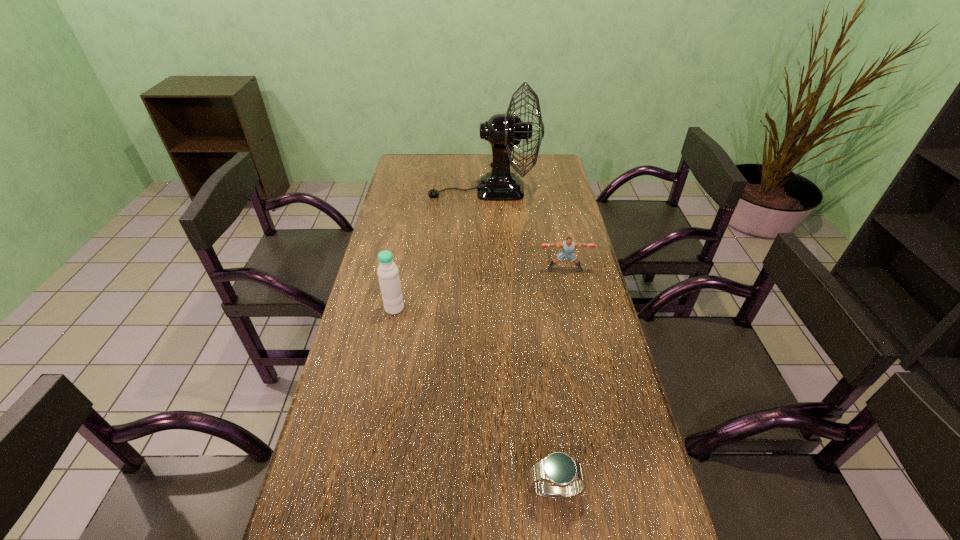
Where is `free space between the second nearest object and the farthest object`? free space between the second nearest object and the farthest object is located at coordinates (439, 249).

Where is `vacant space in between the second tallest object and the third nearest object`? Image resolution: width=960 pixels, height=540 pixels. vacant space in between the second tallest object and the third nearest object is located at coordinates tap(479, 289).

Where is `vacant space in between the third shortest object and the farthest object`? This screenshot has width=960, height=540. vacant space in between the third shortest object and the farthest object is located at coordinates (439, 249).

Identify the location of vacant region between the puncher and the second tallest object. (479, 289).

The image size is (960, 540). I want to click on vacant region between the third nearest object and the tallest object, so click(x=524, y=230).

Identify the location of blank region between the third tallest object and the farthest object. (524, 230).

You are a GUI agent. You are given a task and a screenshot of the screen. Output one action in this format:
    pyautogui.click(x=<x>, y=<y>)
    Task: Click on the blank region between the nearest object and the farthest object
    
    Given the screenshot: What is the action you would take?
    pyautogui.click(x=519, y=341)

Where is `object that is the closest to the leftmost object`? The height and width of the screenshot is (540, 960). object that is the closest to the leftmost object is located at coordinates (568, 245).

Select which object is the closest to the farthest object. Please provide its 2D coordinates. Your answer should be formatted as a tuple, i.e. [(x, y)], where the tuple contains the x and y coordinates of a point satisfying the conditions above.

[(568, 245)]

Locate an element on the screen. The width and height of the screenshot is (960, 540). blank area in the image that satisfies the following two spatial constraints: 1. in front of the farthest object, indicating the direction of air flow; 2. on the left side of the nearest object is located at coordinates (487, 491).